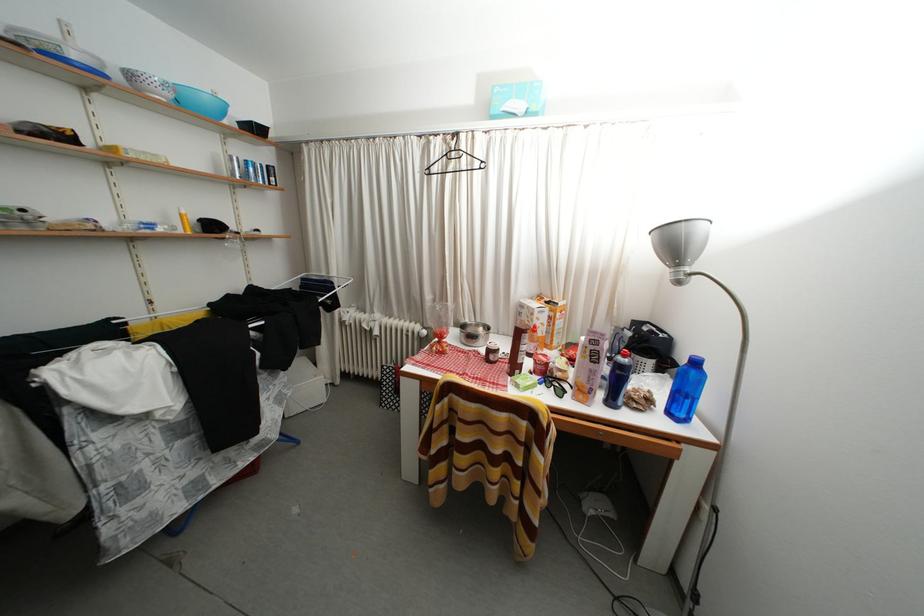
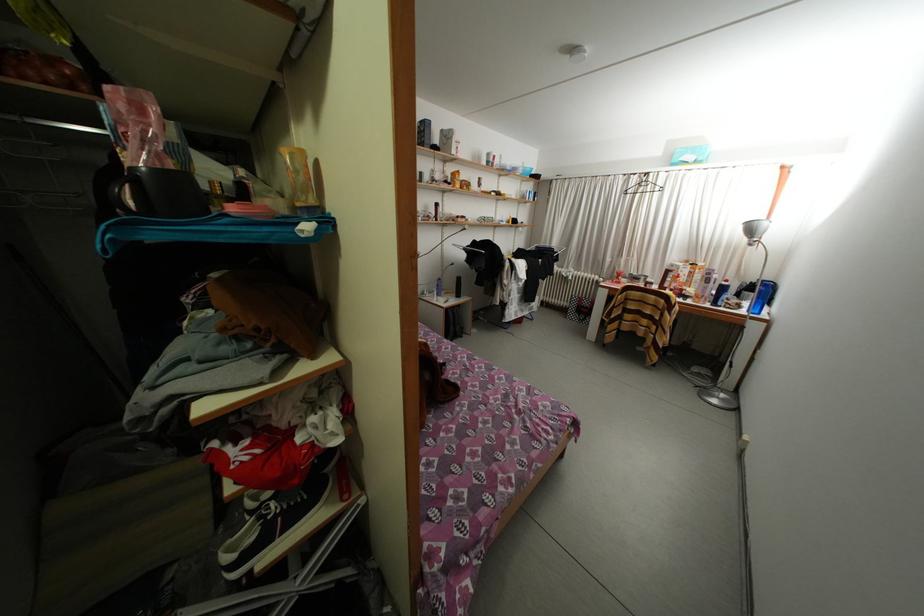
The point at [658,406] is marked in the first image. Where is the corresponding point in the second image?

(747, 310)